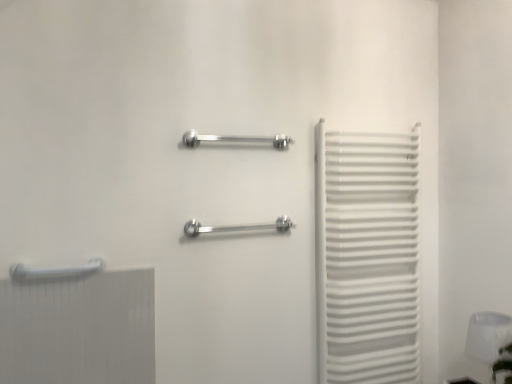
Question: From the image's perspective, is white glossy towel rack at lower left, marked as the 3th towel rack in a right-to-left arrangement, located above or below white glossy lampshade at lower right?

Choices:
 (A) above
 (B) below

Answer: (A)

Question: From a real-world perspective, relative to white glossy lampshade at lower right, is white glossy towel rack at lower left, positioned as the first towel rack in left-to-right order, vertically above or below?

Choices:
 (A) above
 (B) below

Answer: (A)

Question: Based on their relative distances, which object is farther from the white glossy lampshade at lower right?

Choices:
 (A) white glossy towel rack at right
 (B) polished metal towel rack at center, which ranks as the third towel rack in left-to-right order
 (C) white glossy towel rack at lower left, positioned as the third towel rack in top-to-bottom order
 (D) polished chrome towel rack at center, which ranks as the 2th towel rack in right-to-left order

Answer: (C)

Question: Estimate the real-world distances between objects in this image. Which object is farther from the white glossy lampshade at lower right?

Choices:
 (A) white glossy towel rack at lower left, positioned as the third towel rack in top-to-bottom order
 (B) polished metal towel rack at center, which is the second towel rack from top to bottom
 (C) polished chrome towel rack at center, the second towel rack when ordered from left to right
 (D) white glossy towel rack at right

Answer: (A)